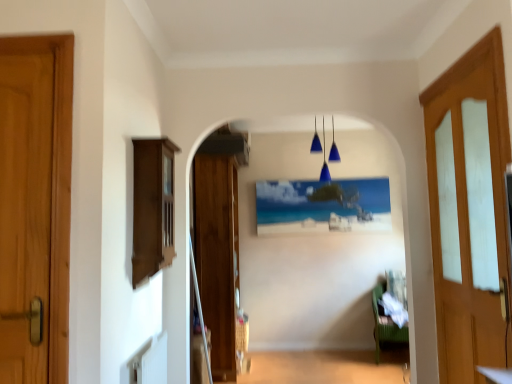
Question: Does matte plastic picture frame at center appear on the left side of wooden door at left, which appears as the first door when viewed from the front?

Choices:
 (A) yes
 (B) no

Answer: (B)

Question: Does matte plastic picture frame at center have a lesser width compared to wooden door at left, which appears as the first door when viewed from the front?

Choices:
 (A) yes
 (B) no

Answer: (A)

Question: Considering the relative sizes of matte plastic picture frame at center and wooden door at left, which is the 1th door from left to right, in the image provided, is matte plastic picture frame at center taller than wooden door at left, which is the 1th door from left to right,?

Choices:
 (A) yes
 (B) no

Answer: (B)

Question: Is wooden door at left, the third door viewed from the back, at the back of matte plastic picture frame at center?

Choices:
 (A) yes
 (B) no

Answer: (B)

Question: Can you confirm if matte plastic picture frame at center is smaller than wooden door at left, which appears as the first door when viewed from the front?

Choices:
 (A) yes
 (B) no

Answer: (B)

Question: From the image's perspective, is light brown wooden door at right, arranged as the first door when viewed from the right, positioned above or below blue glass pendant lights at center?

Choices:
 (A) below
 (B) above

Answer: (A)

Question: Is light brown wooden door at right, the 3th door when ordered from left to right, wider or thinner than blue glass pendant lights at center?

Choices:
 (A) thin
 (B) wide

Answer: (A)

Question: Looking at the image, does light brown wooden door at right, the 3th door when ordered from left to right, seem bigger or smaller compared to blue glass pendant lights at center?

Choices:
 (A) big
 (B) small

Answer: (A)

Question: Is light brown wooden door at right, arranged as the first door when viewed from the right, inside or outside of blue glass pendant lights at center?

Choices:
 (A) inside
 (B) outside

Answer: (B)

Question: Is matte plastic picture frame at center wider or thinner than brown wood cabinet at left?

Choices:
 (A) thin
 (B) wide

Answer: (A)

Question: Considering the positions of matte plastic picture frame at center and brown wood cabinet at left in the image, is matte plastic picture frame at center taller or shorter than brown wood cabinet at left?

Choices:
 (A) short
 (B) tall

Answer: (A)

Question: Is point (266, 210) positioned closer to the camera than point (143, 231)?

Choices:
 (A) closer
 (B) farther

Answer: (B)

Question: Considering the relative positions of matte plastic picture frame at center and brown wood cabinet at left in the image provided, is matte plastic picture frame at center to the left or to the right of brown wood cabinet at left?

Choices:
 (A) right
 (B) left

Answer: (A)

Question: From their relative heights in the image, would you say brown wood cabinet at left is taller or shorter than green fabric couch at lower right?

Choices:
 (A) tall
 (B) short

Answer: (A)

Question: Is point (159, 220) closer or farther from the camera than point (375, 297)?

Choices:
 (A) closer
 (B) farther

Answer: (A)